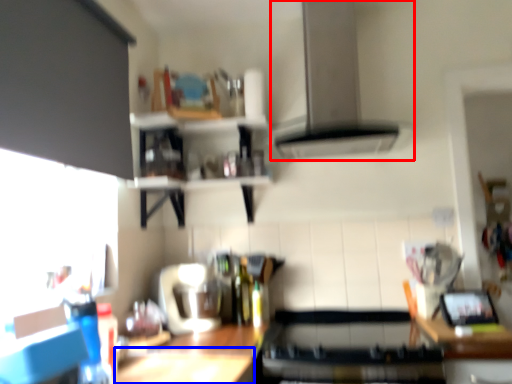
Question: Which of the following is the closest to the observer, exhaust hood (highlighted by a red box) or table (highlighted by a blue box)?

Choices:
 (A) exhaust hood
 (B) table

Answer: (B)